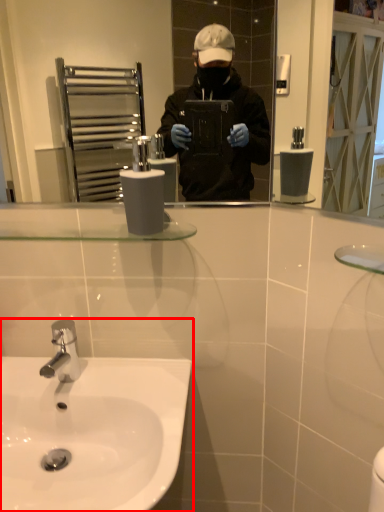
Question: Observing the image, what is the correct spatial positioning of sink (annotated by the red box) in reference to toilet paper?

Choices:
 (A) left
 (B) right

Answer: (A)